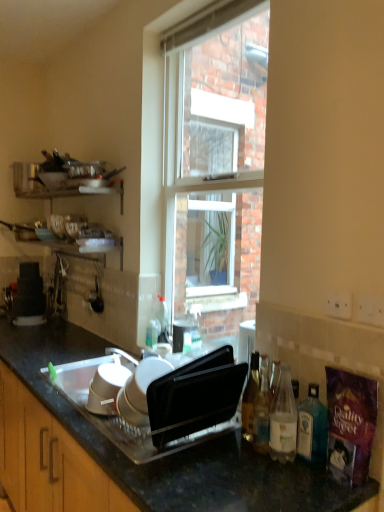
Locate an element on the screen. Image resolution: width=384 pixels, height=512 pixels. free spot to the left of translucent glass bottle at right, which ranks as the 1th bottle in right-to-left order is located at coordinates click(248, 462).